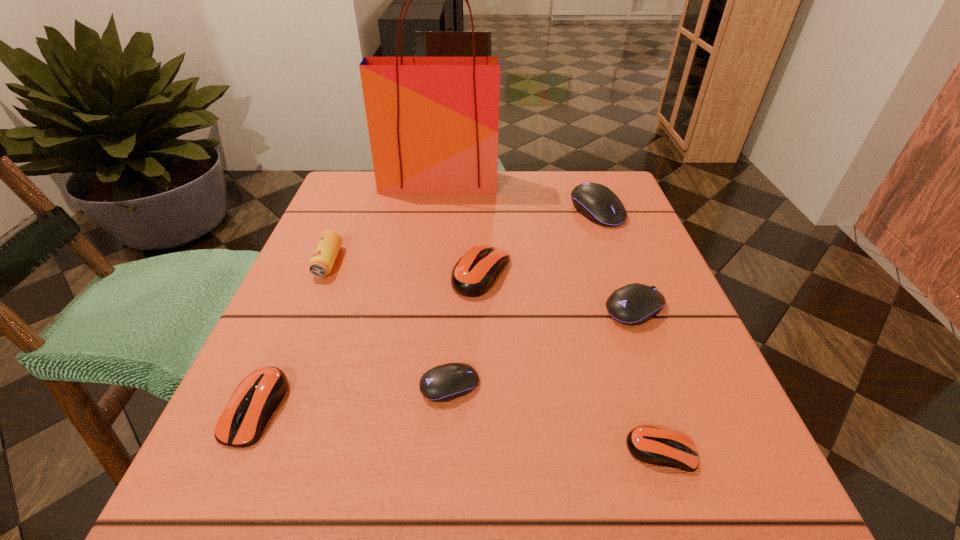
I want to click on object located at the near right corner, so click(652, 445).

The image size is (960, 540). In order to click on vacant space at the far edge of the desktop in this screenshot , I will do `click(463, 202)`.

Locate an element on the screen. The width and height of the screenshot is (960, 540). vacant area at the near edge of the desktop is located at coordinates click(x=464, y=520).

In the image, there is a desktop. Identify the location of free space at the left edge. (317, 326).

This screenshot has height=540, width=960. Find the location of `vacant space at the right edge of the desktop`. vacant space at the right edge of the desktop is located at coordinates (631, 276).

At what (x,y) coordinates should I click in order to perform the action: click on free location at the far left corner of the desktop. Please return your answer as a coordinate pair (x, y). Image resolution: width=960 pixels, height=540 pixels. Looking at the image, I should click on (356, 183).

Image resolution: width=960 pixels, height=540 pixels. In the image, there is a desktop. Identify the location of vacant space at the far right corner. (565, 201).

Find the location of a particular element. unoccupied position between the smallest black computer mouse and the biggest black computer mouse is located at coordinates (523, 298).

Where is `free point between the second farthest black computer mouse and the tallest object`? free point between the second farthest black computer mouse and the tallest object is located at coordinates (537, 246).

Locate an element on the screen. This screenshot has width=960, height=540. free space between the second nearest black computer mouse and the second orange computer mouse from right to left is located at coordinates (558, 291).